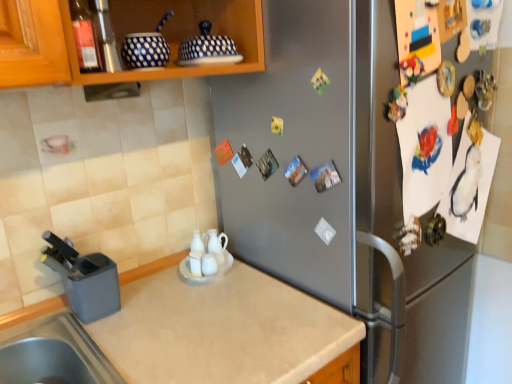
Question: Is gray plastic knife block at lower left, the first appliance in the bottom-to-top sequence, looking in the opposite direction of beige laminate countertop at lower left?

Choices:
 (A) yes
 (B) no

Answer: (B)

Question: Is gray plastic knife block at lower left, which is the 1th appliance from left to right, closer to camera compared to beige laminate countertop at lower left?

Choices:
 (A) no
 (B) yes

Answer: (A)

Question: Considering the relative sizes of gray plastic knife block at lower left, the first appliance in the bottom-to-top sequence, and beige laminate countertop at lower left in the image provided, is gray plastic knife block at lower left, the first appliance in the bottom-to-top sequence, shorter than beige laminate countertop at lower left?

Choices:
 (A) yes
 (B) no

Answer: (A)

Question: Can you confirm if gray plastic knife block at lower left, which is the 1th appliance from left to right, is bigger than beige laminate countertop at lower left?

Choices:
 (A) yes
 (B) no

Answer: (B)

Question: Considering the relative positions of gray plastic knife block at lower left, the first appliance in the bottom-to-top sequence, and beige laminate countertop at lower left in the image provided, is gray plastic knife block at lower left, the first appliance in the bottom-to-top sequence, behind beige laminate countertop at lower left?

Choices:
 (A) no
 (B) yes

Answer: (B)

Question: Based on their sizes in the image, would you say satin silver fridge at center is bigger or smaller than beige laminate countertop at lower left?

Choices:
 (A) big
 (B) small

Answer: (A)

Question: Is satin silver fridge at center inside or outside of beige laminate countertop at lower left?

Choices:
 (A) inside
 (B) outside

Answer: (B)

Question: Is satin silver fridge at center taller or shorter than beige laminate countertop at lower left?

Choices:
 (A) short
 (B) tall

Answer: (B)

Question: Is point (408, 304) closer or farther from the camera than point (158, 375)?

Choices:
 (A) farther
 (B) closer

Answer: (A)

Question: Visually, is translucent glass bottle at upper left positioned to the left or to the right of satin silver fridge at center?

Choices:
 (A) right
 (B) left

Answer: (B)

Question: From their relative heights in the image, would you say translucent glass bottle at upper left is taller or shorter than satin silver fridge at center?

Choices:
 (A) tall
 (B) short

Answer: (B)

Question: Does point (80, 21) appear closer or farther from the camera than point (268, 94)?

Choices:
 (A) closer
 (B) farther

Answer: (A)

Question: Would you say translucent glass bottle at upper left is inside or outside satin silver fridge at center?

Choices:
 (A) outside
 (B) inside

Answer: (A)

Question: From the image's perspective, is satin silver fridge at center positioned above or below translucent glass bottle at upper left?

Choices:
 (A) above
 (B) below

Answer: (B)

Question: Is satin silver fridge at center situated inside translucent glass bottle at upper left or outside?

Choices:
 (A) outside
 (B) inside

Answer: (A)